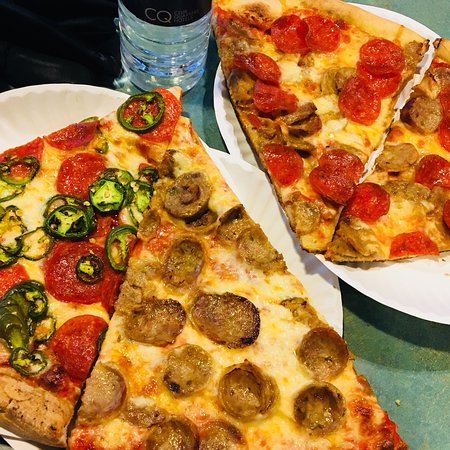
This screenshot has width=450, height=450. I want to click on paper plates, so click(x=404, y=282), click(x=37, y=110), click(x=229, y=120), click(x=255, y=187).